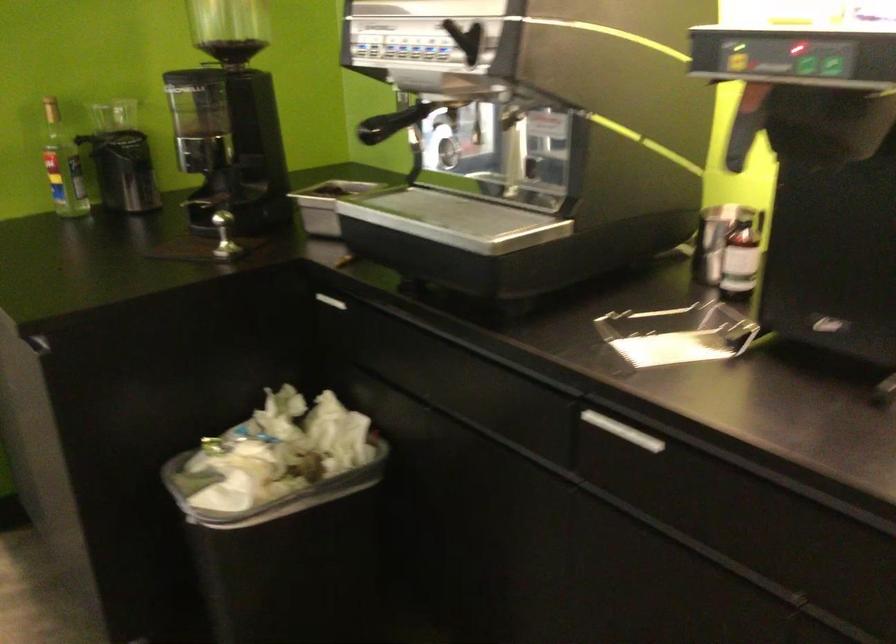
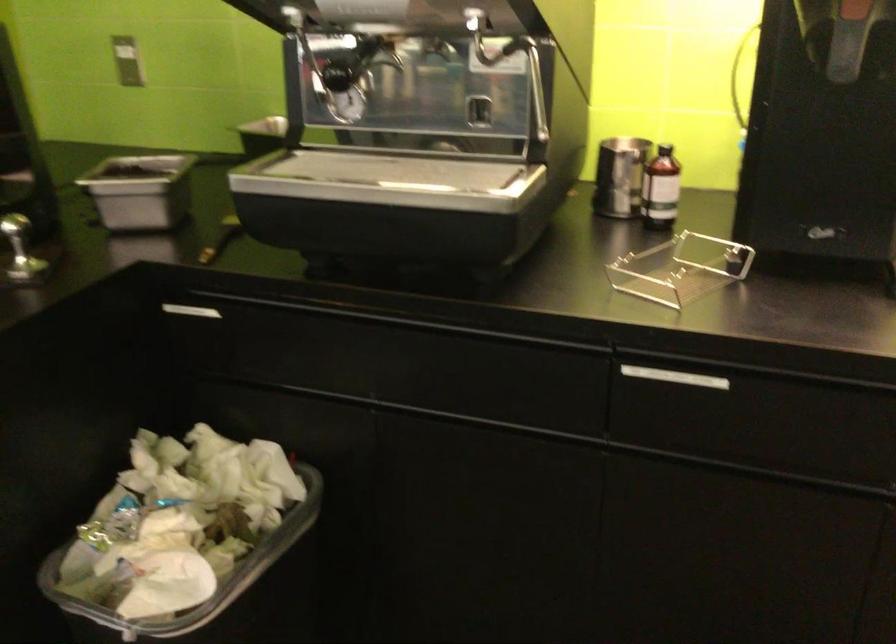
In the second image, find the point that corresponds to point 737,227 in the first image.

(666, 152)